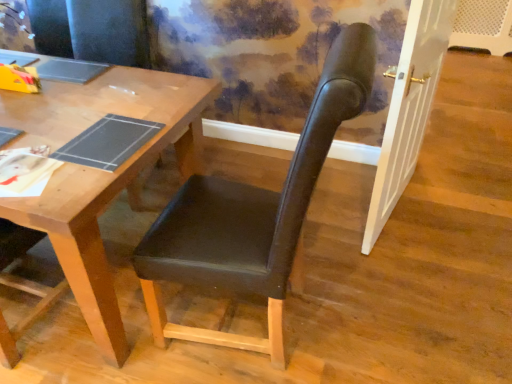
The width and height of the screenshot is (512, 384). I want to click on vacant area located to the right-hand side of black leather chair at center, so click(379, 313).